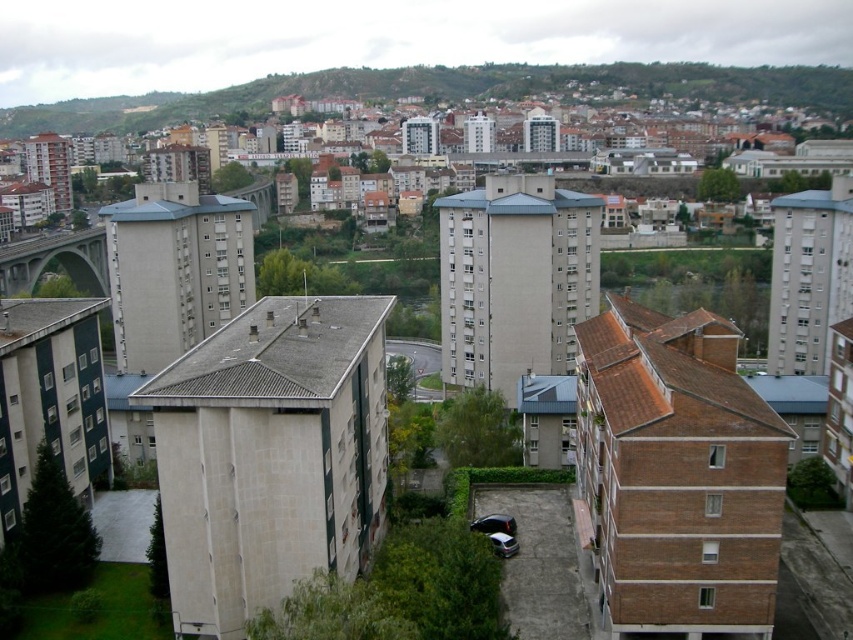
Who is positioned more to the right, shiny black car at center or silver metallic car at center?

Positioned to the right is silver metallic car at center.

Is point (490, 531) behind point (496, 548)?

Yes, point (490, 531) is behind point (496, 548).

Is point (489, 531) in front of point (502, 532)?

No, (489, 531) is behind (502, 532).

In order to click on shiny black car at center in this screenshot , I will do `click(494, 524)`.

Can you confirm if green grassy hillside at upper center is taller than shiny black car at center?

Correct, green grassy hillside at upper center is much taller as shiny black car at center.

Does green grassy hillside at upper center have a smaller size compared to shiny black car at center?

No.

Between point (764, 76) and point (479, 524), which one is positioned in front?

Point (479, 524) is more forward.

The width and height of the screenshot is (853, 640). What are the coordinates of `green grassy hillside at upper center` in the screenshot? It's located at (445, 92).

Find the location of a particular element. The width and height of the screenshot is (853, 640). green grassy hillside at upper center is located at coordinates (445, 92).

Which is below, green grassy hillside at upper center or silver metallic car at center?

silver metallic car at center is below.

This screenshot has width=853, height=640. Identify the location of green grassy hillside at upper center. (445, 92).

Where is `green grassy hillside at upper center`? This screenshot has height=640, width=853. green grassy hillside at upper center is located at coordinates (445, 92).